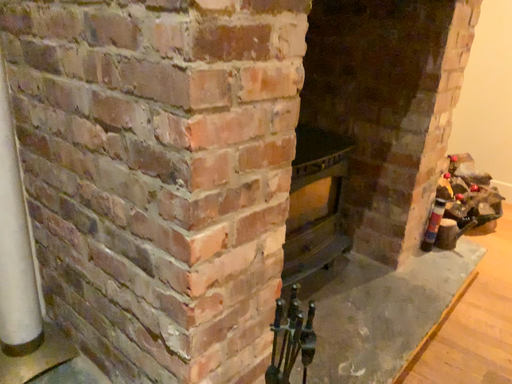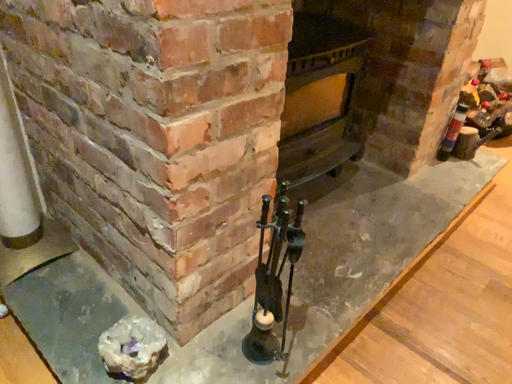
Question: Which way did the camera rotate in the video?

Choices:
 (A) rotated upward
 (B) rotated downward

Answer: (B)